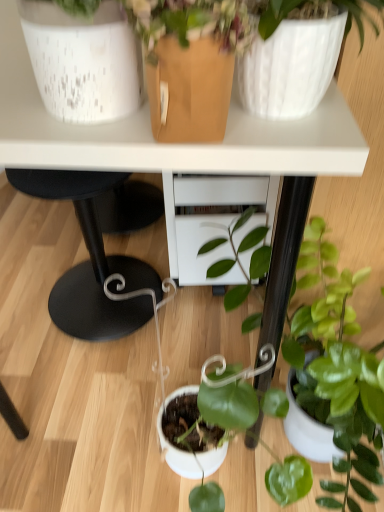
Question: From a real-world perspective, is white glossy table at upper center positioned above or below white speckled ceramic pot at upper left?

Choices:
 (A) below
 (B) above

Answer: (A)

Question: Considering the positions of white glossy table at upper center and white speckled ceramic pot at upper left in the image, is white glossy table at upper center taller or shorter than white speckled ceramic pot at upper left?

Choices:
 (A) tall
 (B) short

Answer: (A)

Question: Estimate the real-world distances between objects in this image. Which object is farther from the green glossy plant at lower right?

Choices:
 (A) white speckled ceramic pot at upper left
 (B) white glossy table at upper center

Answer: (A)

Question: Which object is the farthest from the white glossy table at upper center?

Choices:
 (A) white speckled ceramic pot at upper left
 (B) green glossy plant at lower right

Answer: (B)